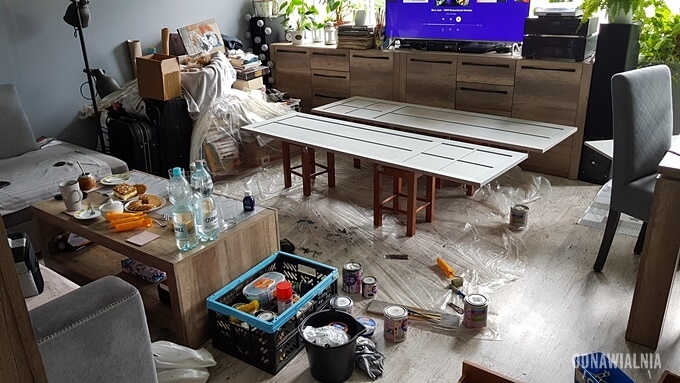
This screenshot has height=383, width=680. Identify the location of black plastic milk crate. coord(264,352).